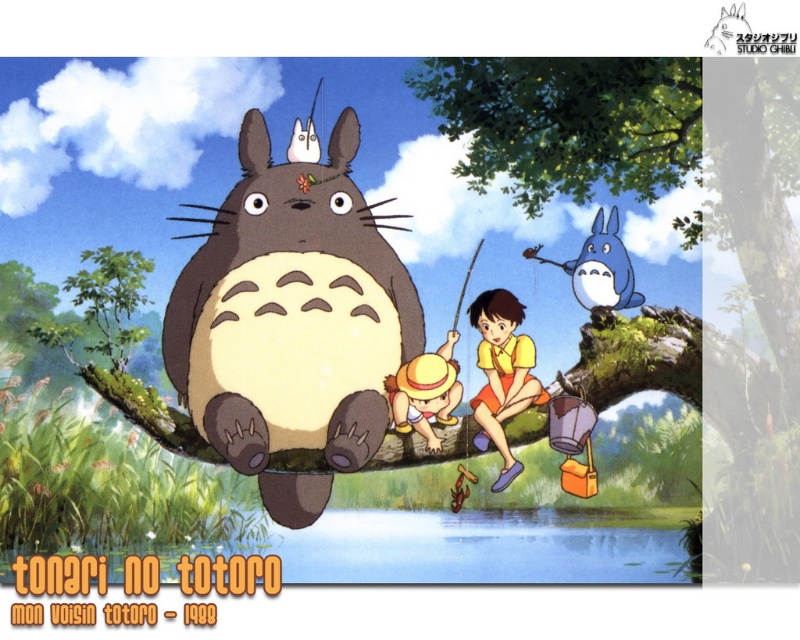
Question: Does brown fuzzy totoro at center have a larger size compared to yellow matte shorts at center?

Choices:
 (A) yes
 (B) no

Answer: (A)

Question: Does brown fuzzy totoro at center appear over blue matte totoro at upper center?

Choices:
 (A) yes
 (B) no

Answer: (B)

Question: Which point is closer to the camera taking this photo?

Choices:
 (A) (590, 234)
 (B) (501, 342)
 (C) (285, 332)

Answer: (B)

Question: Is brown fuzzy totoro at center above blue matte totoro at upper center?

Choices:
 (A) no
 (B) yes

Answer: (A)

Question: Which object is positioned closest to the yellow matte shorts at center?

Choices:
 (A) brown fuzzy totoro at center
 (B) blue matte totoro at upper center

Answer: (B)

Question: Which is farther from the brown fuzzy totoro at center?

Choices:
 (A) blue matte totoro at upper center
 (B) yellow matte shorts at center

Answer: (A)